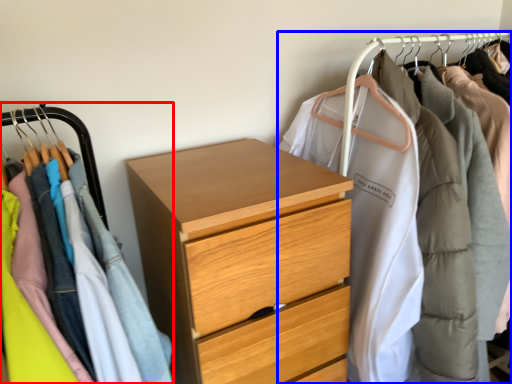
Question: Which point is further to the camera, closet (highlighted by a red box) or closet (highlighted by a blue box)?

Choices:
 (A) closet
 (B) closet

Answer: (B)